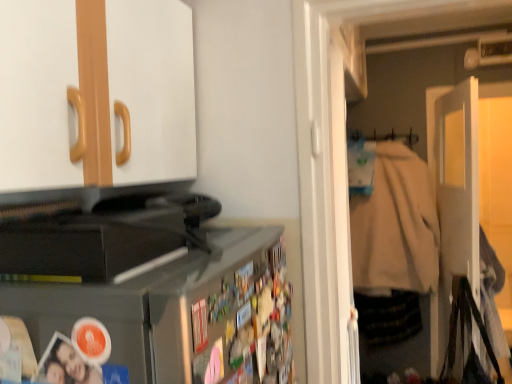
Question: From a real-world perspective, is beige cotton jacket at right above or below black plastic toaster at lower left?

Choices:
 (A) below
 (B) above

Answer: (A)

Question: Considering the positions of beige cotton jacket at right and black plastic toaster at lower left in the image, is beige cotton jacket at right bigger or smaller than black plastic toaster at lower left?

Choices:
 (A) big
 (B) small

Answer: (A)

Question: Which object is positioned closest to the beige cotton jacket at right?

Choices:
 (A) white fabric hanger at upper right
 (B) black plastic toaster at lower left
 (C) white matte door at right

Answer: (C)

Question: Estimate the real-world distances between objects in this image. Which object is closer to the white fabric hanger at upper right?

Choices:
 (A) black plastic toaster at lower left
 (B) white matte door at right
 (C) beige cotton jacket at right

Answer: (C)